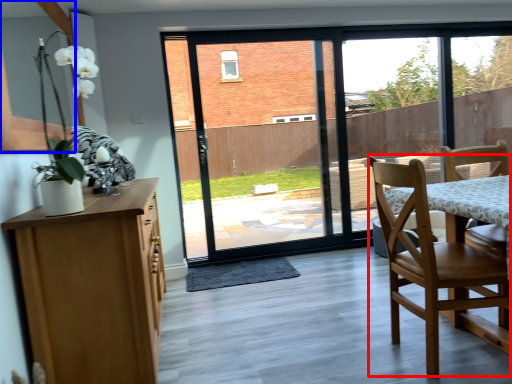
Question: Among these objects, which one is nearest to the camera, chair (highlighted by a red box) or window screen (highlighted by a blue box)?

Choices:
 (A) chair
 (B) window screen

Answer: (B)